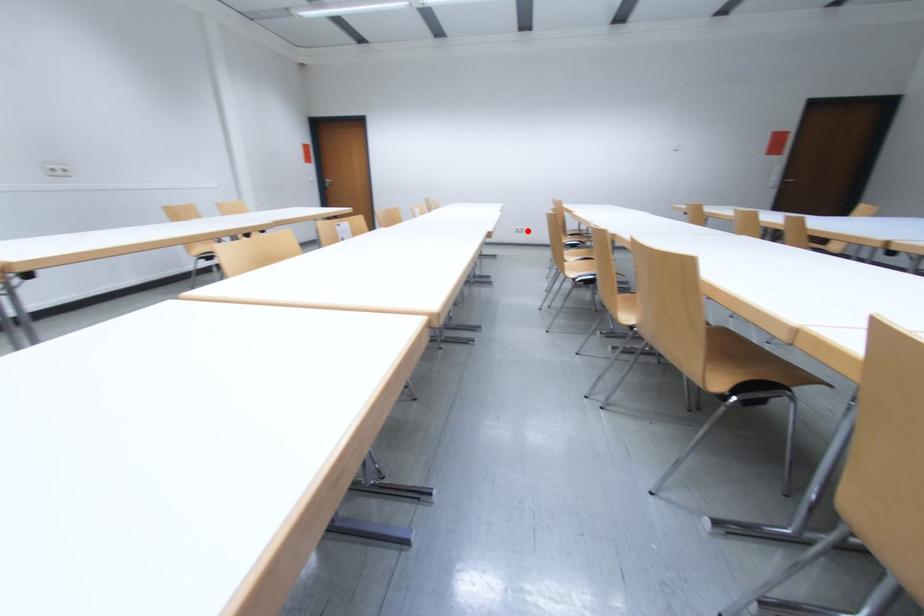
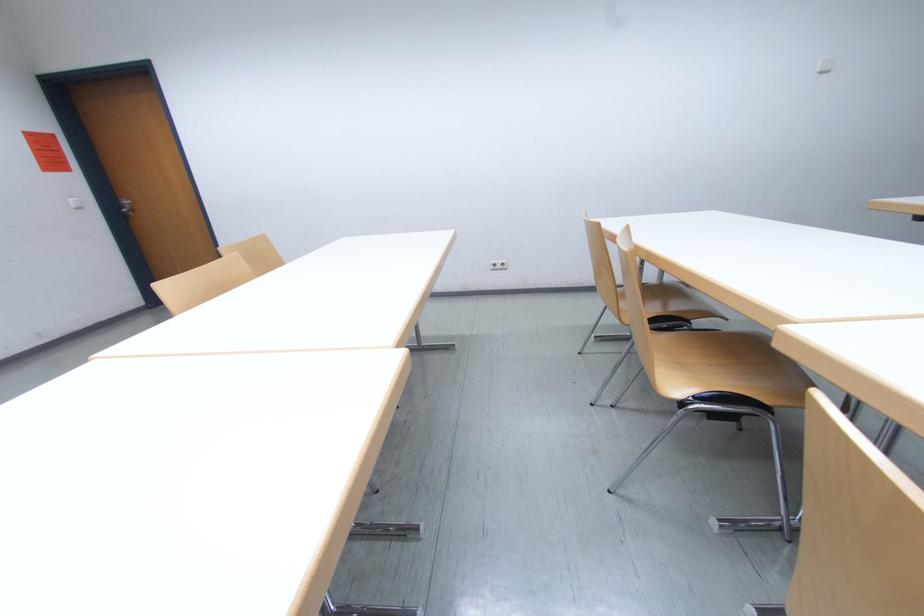
The point at the highlighted location is marked in the first image. Where is the corresponding point in the second image?

(505, 265)